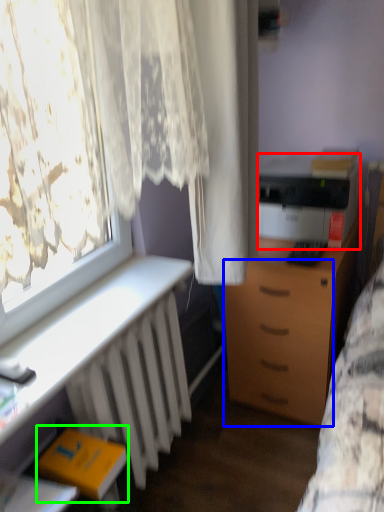
Question: Which is farther away from printer (highlighted by a red box)? drawer (highlighted by a blue box) or book (highlighted by a green box)?

Choices:
 (A) drawer
 (B) book

Answer: (B)